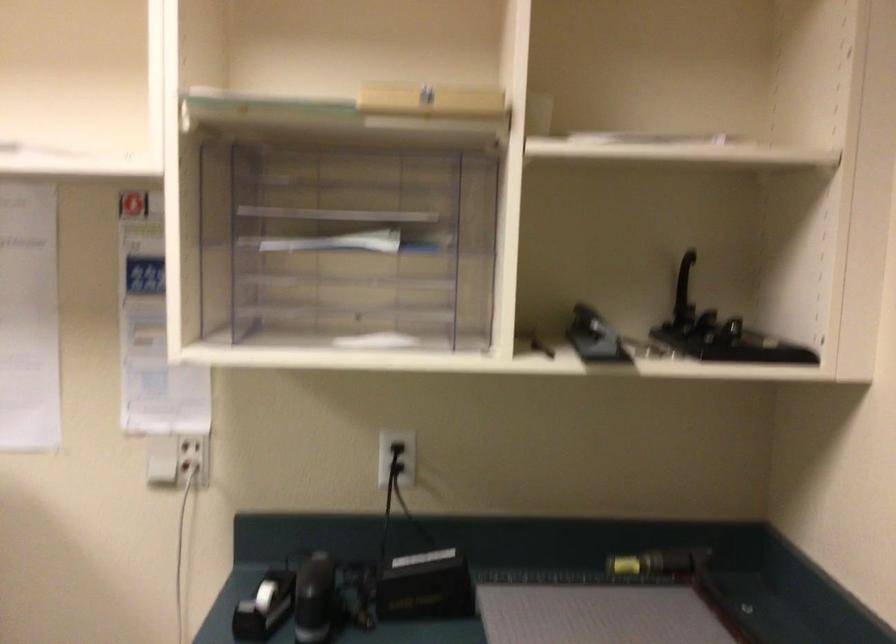
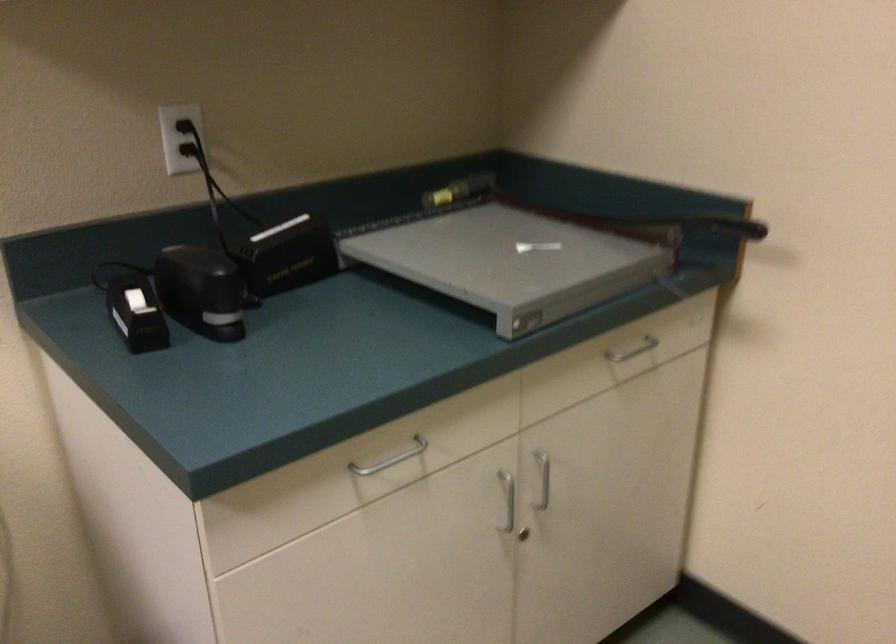
Where in the second image is the point corresponding to point (394, 469) from the first image?

(192, 149)